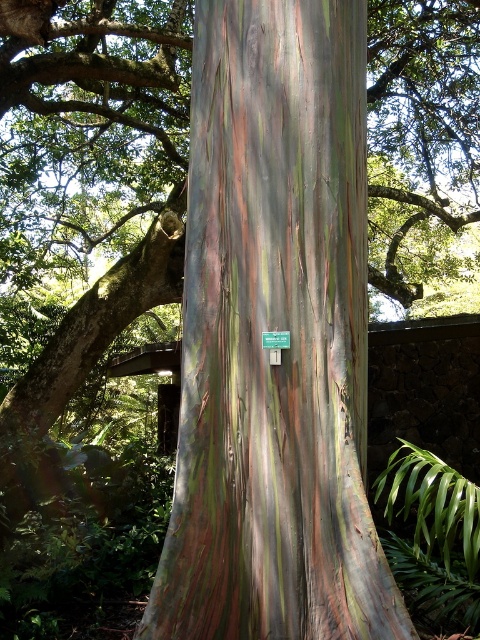
Question: Which object is the farthest from the green plastic sign at center?

Choices:
 (A) rainbow bark tree trunk at center
 (B) rainbow bark eucalyptus at lower right

Answer: (B)

Question: Is rainbow bark tree trunk at center bigger than rainbow bark eucalyptus at lower right?

Choices:
 (A) no
 (B) yes

Answer: (B)

Question: Does rainbow bark tree trunk at center have a smaller size compared to rainbow bark eucalyptus at lower right?

Choices:
 (A) yes
 (B) no

Answer: (B)

Question: Which point is farther to the camera?

Choices:
 (A) (263, 336)
 (B) (419, 598)
 (C) (196, 596)

Answer: (B)

Question: Can you confirm if rainbow bark tree trunk at center is positioned to the left of green plastic sign at center?

Choices:
 (A) no
 (B) yes

Answer: (A)

Question: Which point is closer to the camera taking this photo?

Choices:
 (A) (336, 225)
 (B) (264, 342)
 (C) (422, 600)

Answer: (B)